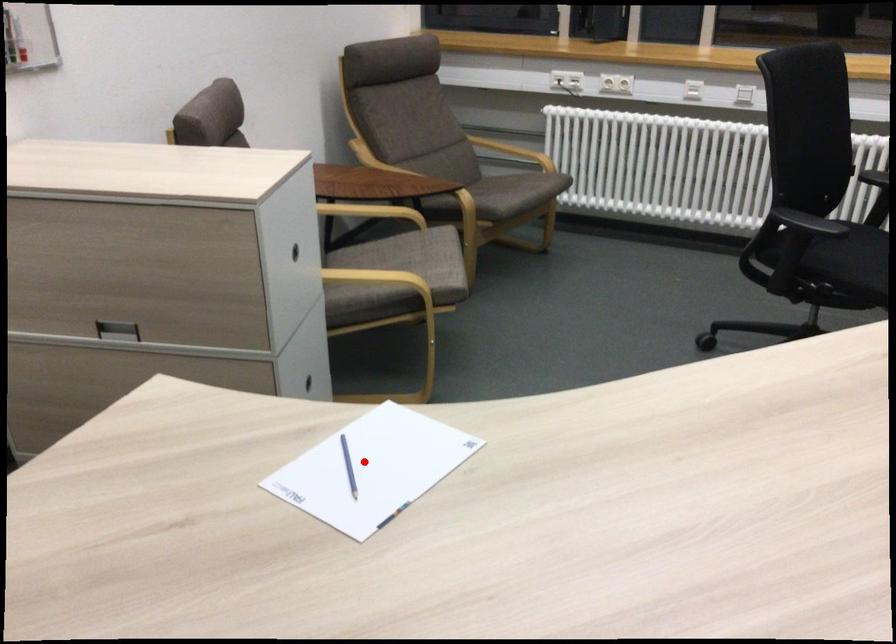
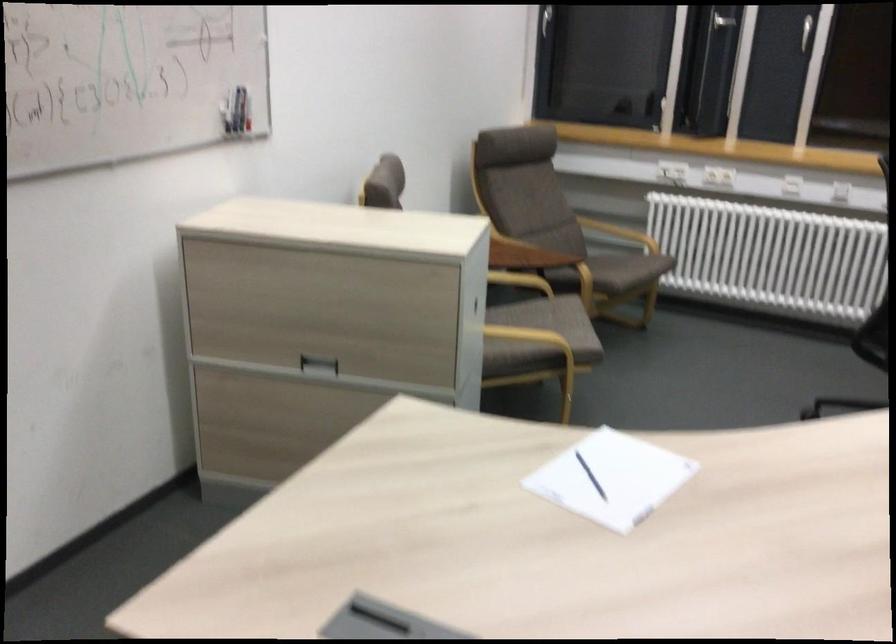
Find the pixel in the second image that matches the highlighted location in the first image.

(590, 476)